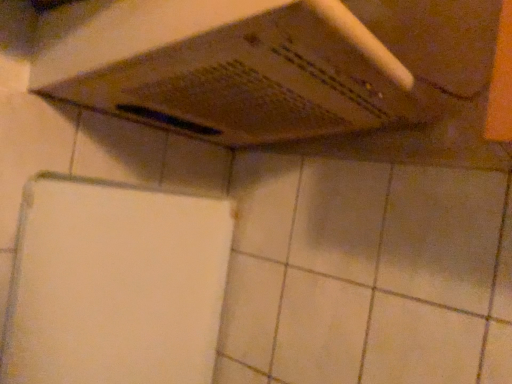
What is the approximate width of matte brown laptop at upper center?

matte brown laptop at upper center is 50.26 centimeters wide.

The image size is (512, 384). Describe the element at coordinates (236, 72) in the screenshot. I see `matte brown laptop at upper center` at that location.

Where is `matte brown laptop at upper center`? Image resolution: width=512 pixels, height=384 pixels. matte brown laptop at upper center is located at coordinates (236, 72).

This screenshot has height=384, width=512. I want to click on matte brown laptop at upper center, so [236, 72].